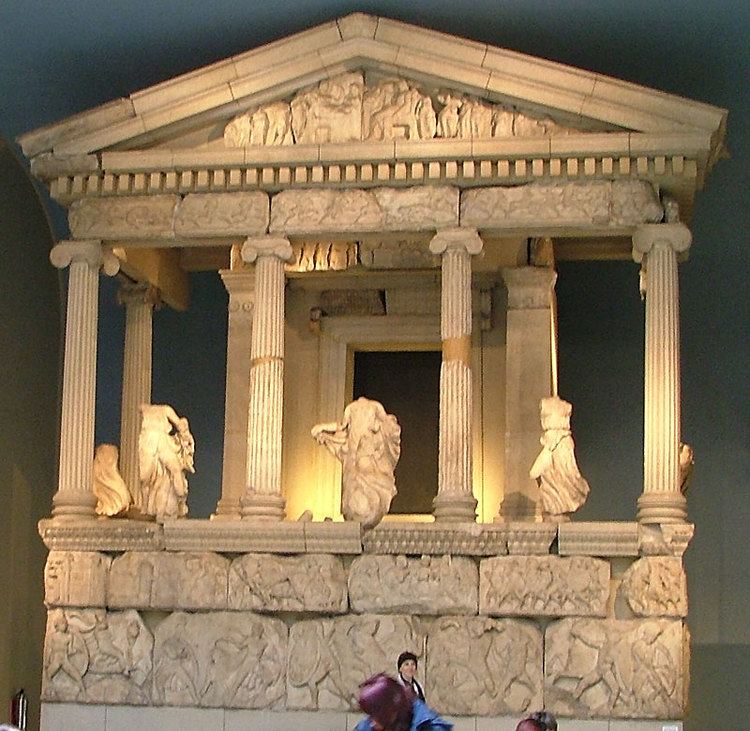
You are a GUI agent. You are given a task and a screenshot of the screen. Output one action in this format:
    pyautogui.click(x=<x>, y=<y>)
    Task: Click on the above doorway
    The image size is (750, 731).
    Given the screenshot: What is the action you would take?
    pyautogui.click(x=355, y=341), pyautogui.click(x=398, y=340), pyautogui.click(x=436, y=336)